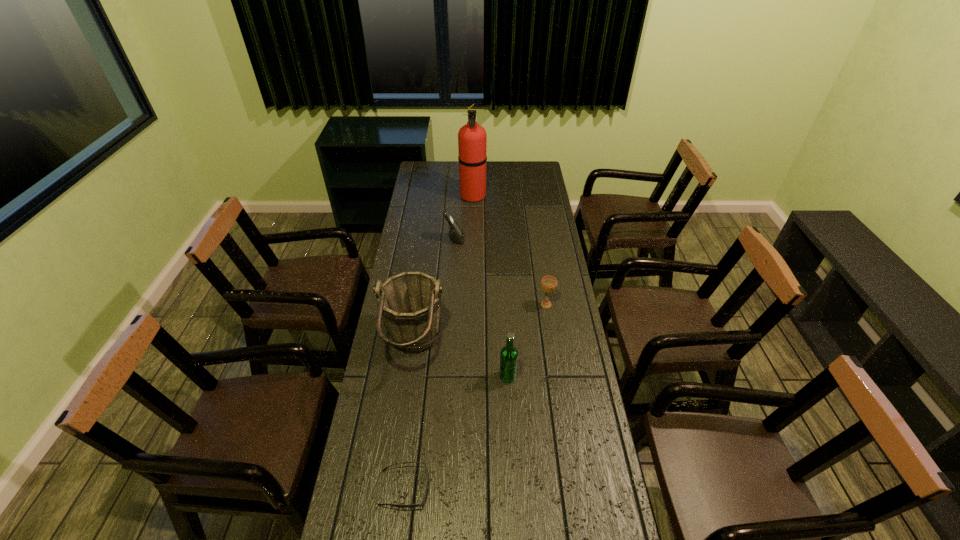
What are the coordinates of `empty space that is in between the fourth shortest object and the bucket` in the screenshot? It's located at (461, 361).

Identify the location of vacant region between the shortest object and the third tallest object. The image size is (960, 540). (456, 432).

Locate an element on the screen. free spot between the bucket and the sunglasses is located at coordinates (409, 417).

The height and width of the screenshot is (540, 960). In order to click on object that stands as the fourth closest to the second object from right to left in this screenshot , I will do `click(456, 234)`.

Identify which object is located as the second nearest to the beer bottle. Please provide its 2D coordinates. Your answer should be formatted as a tuple, i.e. [(x, y)], where the tuple contains the x and y coordinates of a point satisfying the conditions above.

[(548, 283)]

Image resolution: width=960 pixels, height=540 pixels. Find the location of `vacant area that satisfies the following two spatial constraints: 1. on the front-facing side of the rightmost object; 2. on the right side of the fourth tallest object`. vacant area that satisfies the following two spatial constraints: 1. on the front-facing side of the rightmost object; 2. on the right side of the fourth tallest object is located at coordinates (450, 305).

Locate an element on the screen. free location that satisfies the following two spatial constraints: 1. on the handle side of the bucket; 2. on the back side of the beer bottle is located at coordinates (x=409, y=376).

Locate an element on the screen. free point that satisfies the following two spatial constraints: 1. on the handle side of the bucket; 2. on the back side of the second object from right to left is located at coordinates (409, 376).

At what (x,y) coordinates should I click in order to perform the action: click on vacant point that satisfies the following two spatial constraints: 1. at the nozzle of the tallest object; 2. on the left side of the rightmost object. Please return your answer as a coordinate pair (x, y). Image resolution: width=960 pixels, height=540 pixels. Looking at the image, I should click on (470, 305).

The image size is (960, 540). I want to click on vacant region that satisfies the following two spatial constraints: 1. on the front-facing side of the fifth nearest object; 2. on the right side of the fourth shortest object, so click(x=445, y=376).